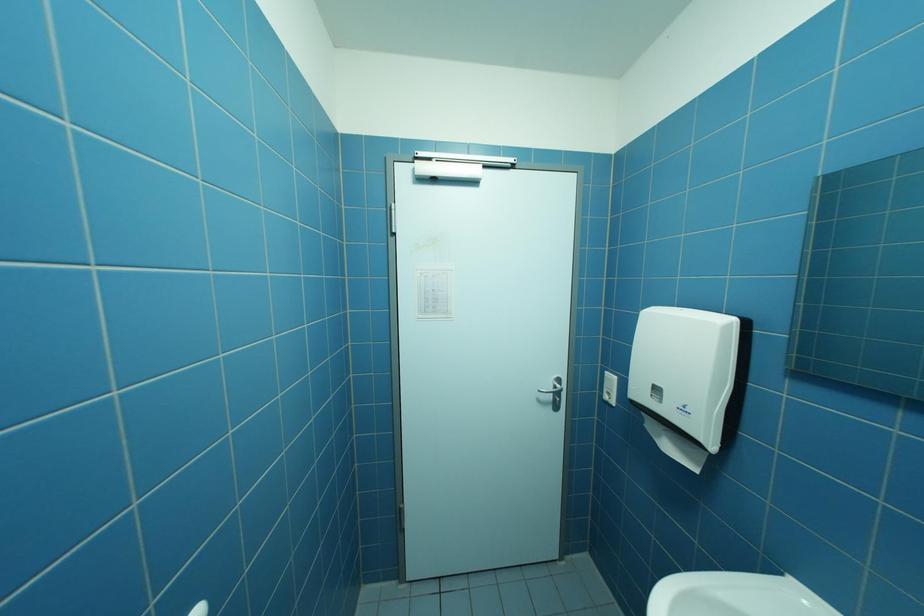
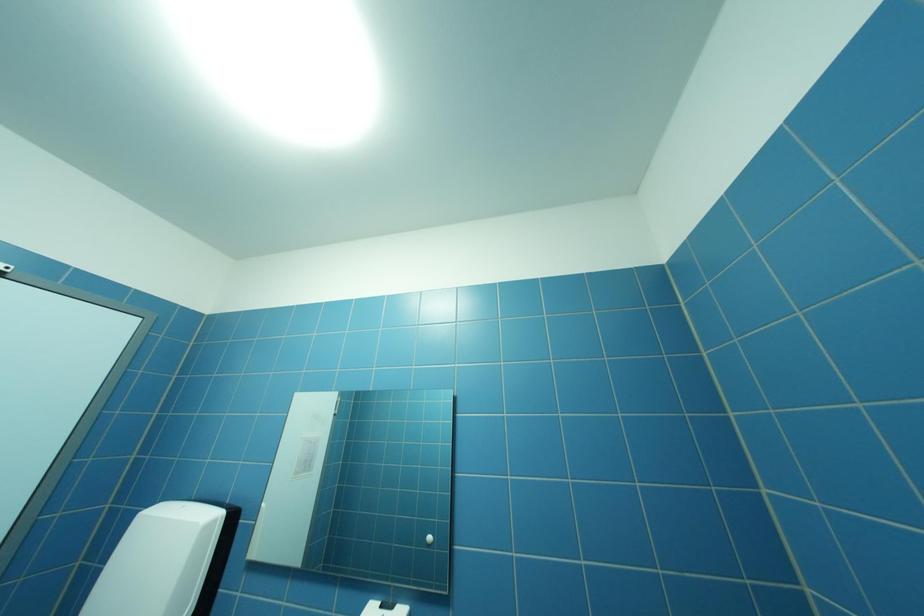
Based on the continuous images, in which direction is the camera rotating?

The camera rotated toward right-up.